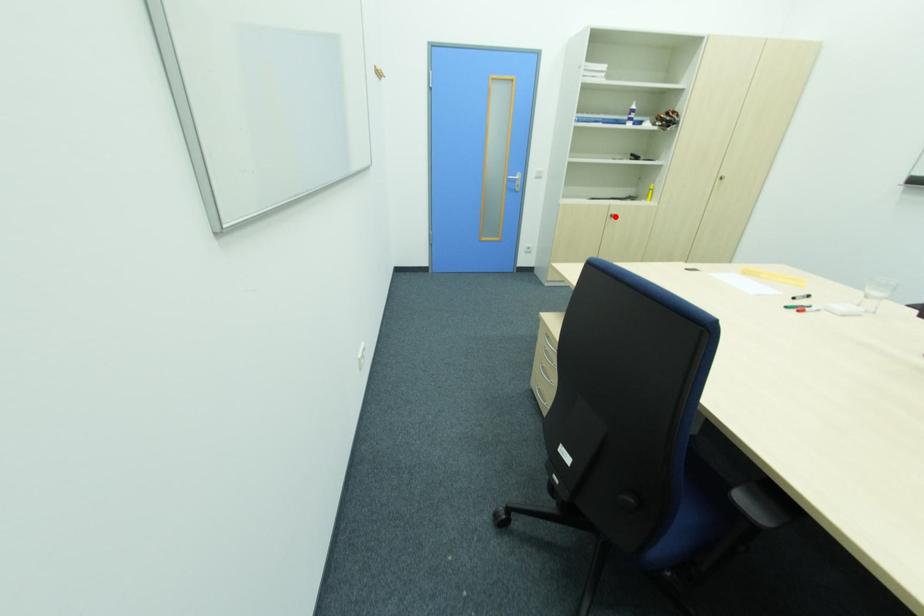
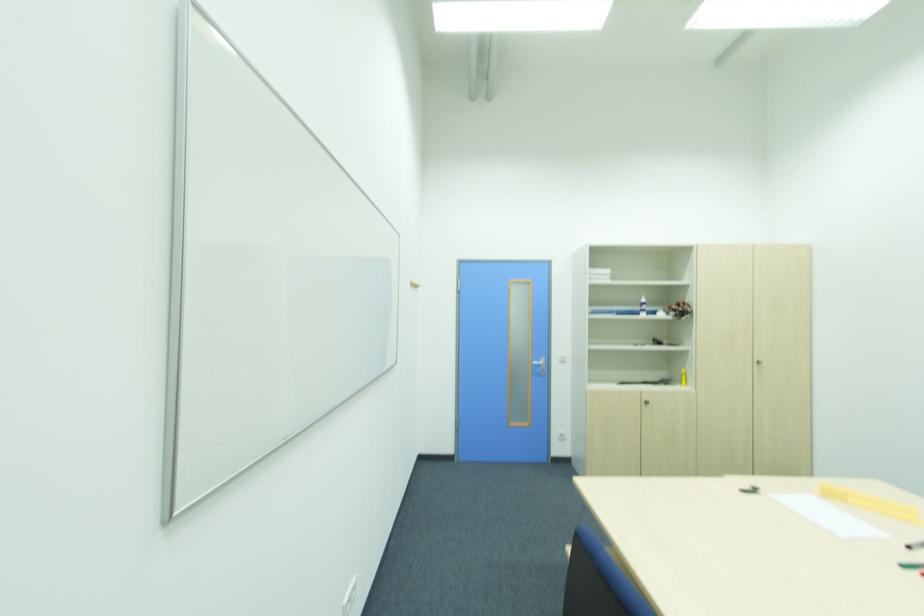
Question: I am providing you with two images of the same scene from different viewpoints. In image1, a red point is highlighted. Considering the same 3D point in image2, which of the following is correct?

Choices:
 (A) It is closer
 (B) It is farther

Answer: (B)